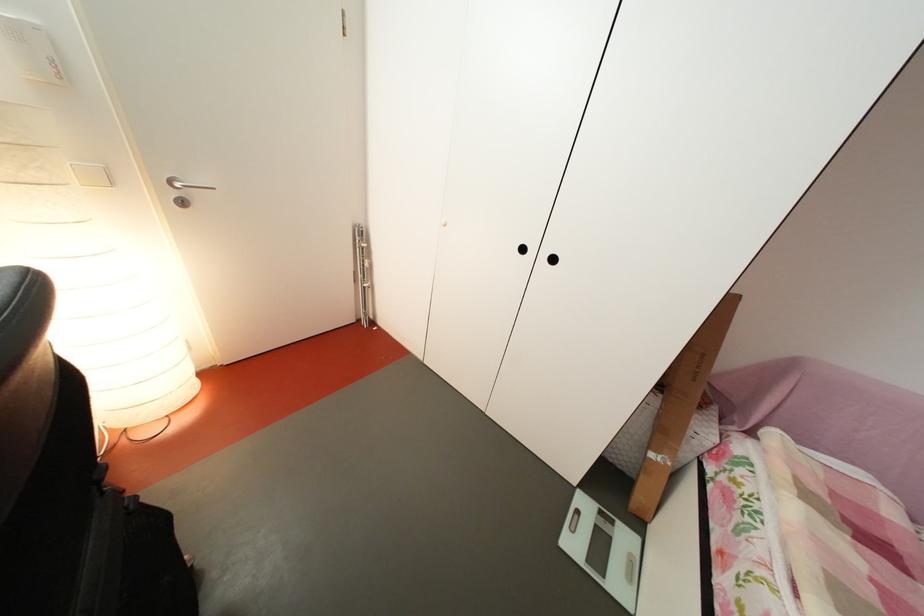
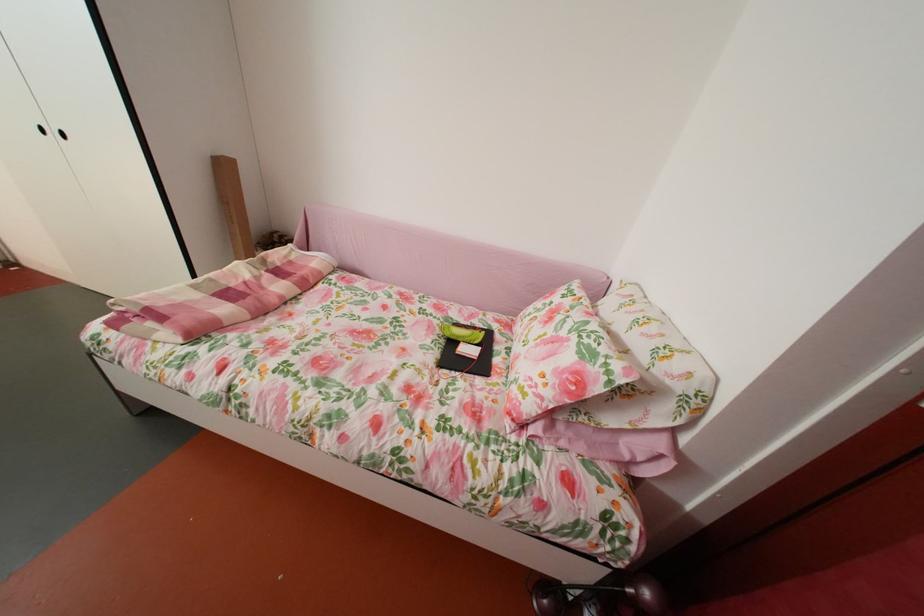
Locate, in the second image, the point that corresponds to pixel 859 544 in the first image.

(274, 278)